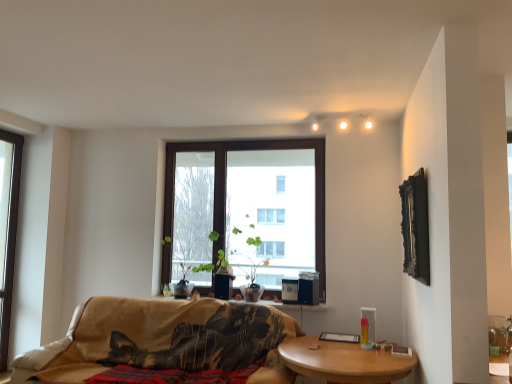
Question: From the image's perspective, is wooden at lower right on top of matte white light bulb at upper center?

Choices:
 (A) yes
 (B) no

Answer: (B)

Question: Is wooden at lower right positioned beyond the bounds of matte white light bulb at upper center?

Choices:
 (A) yes
 (B) no

Answer: (A)

Question: Can you confirm if wooden at lower right is taller than matte white light bulb at upper center?

Choices:
 (A) no
 (B) yes

Answer: (B)

Question: Can you confirm if wooden at lower right is positioned to the right of matte white light bulb at upper center?

Choices:
 (A) no
 (B) yes

Answer: (A)

Question: Does wooden at lower right have a lesser width compared to matte white light bulb at upper center?

Choices:
 (A) no
 (B) yes

Answer: (A)

Question: Looking at their shapes, would you say brown wooden window at center, the second window when ordered from left to right, is wider or thinner than green leafy plant at center?

Choices:
 (A) wide
 (B) thin

Answer: (B)

Question: Is brown wooden window at center, the second window when ordered from left to right, situated inside green leafy plant at center or outside?

Choices:
 (A) inside
 (B) outside

Answer: (B)

Question: Looking at the image, does brown wooden window at center, the second window when ordered from left to right, seem bigger or smaller compared to green leafy plant at center?

Choices:
 (A) small
 (B) big

Answer: (B)

Question: From their relative heights in the image, would you say brown wooden window at center, the second window when ordered from left to right, is taller or shorter than green leafy plant at center?

Choices:
 (A) short
 (B) tall

Answer: (B)

Question: Looking at their shapes, would you say brown wooden window at center, which is the first window from right to left, is wider or thinner than beige fabric couch at center?

Choices:
 (A) thin
 (B) wide

Answer: (A)

Question: Is brown wooden window at center, which is the first window from right to left, taller or shorter than beige fabric couch at center?

Choices:
 (A) tall
 (B) short

Answer: (A)

Question: Is brown wooden window at center, the second window when ordered from left to right, in front of or behind beige fabric couch at center in the image?

Choices:
 (A) front
 (B) behind

Answer: (B)

Question: From the image's perspective, relative to beige fabric couch at center, is brown wooden window at center, the second window when ordered from left to right, above or below?

Choices:
 (A) below
 (B) above

Answer: (B)

Question: Is beige fabric couch at center situated inside black wood picture frame at upper right or outside?

Choices:
 (A) inside
 (B) outside

Answer: (B)

Question: Looking at the image, does beige fabric couch at center seem bigger or smaller compared to black wood picture frame at upper right?

Choices:
 (A) big
 (B) small

Answer: (A)